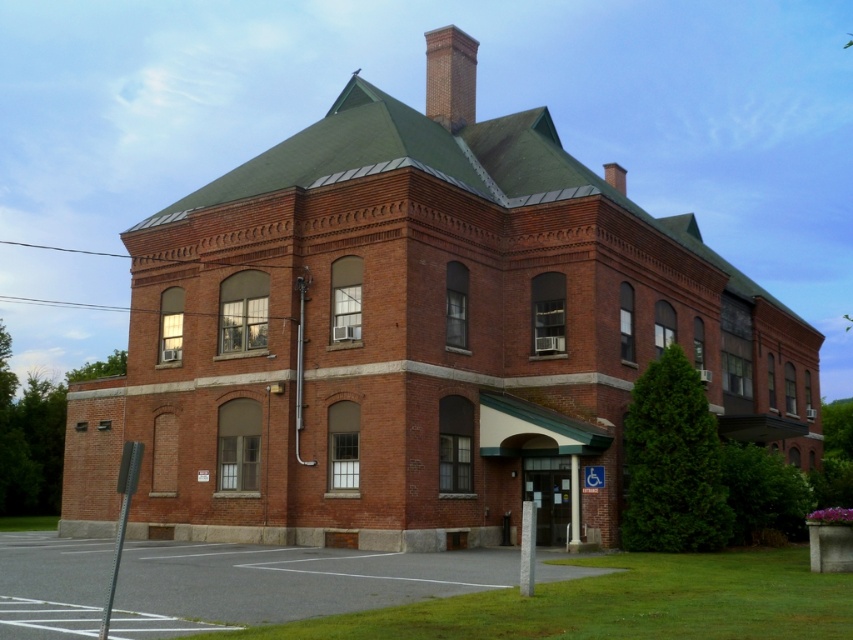
You are standing in front of a two story brick building with a steeply pitched green roof and a central chimney. You see a point at coordinates point (468, 109). Is this point closer to you or farther away than 60 meters?

The point at coordinates point (468, 109) is 63.63 meters away from you, so it is farther away than 60 meters.

You are standing in front of the two story brick building. You see the brick chimney at upper center and the smooth gray pole at lower left. Which object is closer to you?

The brick chimney at upper center is closer to you than the smooth gray pole at lower left.

You are standing in front of the two story brick building and want to place a new decorative flag. The flag needs to be placed between the smooth gray pole at lower left and the smooth brick chimney at upper center. Where should the flag be placed?

The flag should be placed between the smooth gray pole at lower left and the smooth brick chimney at upper center, positioned above the smooth gray pole at lower left and below the smooth brick chimney at upper center since the pole is below the chimney.